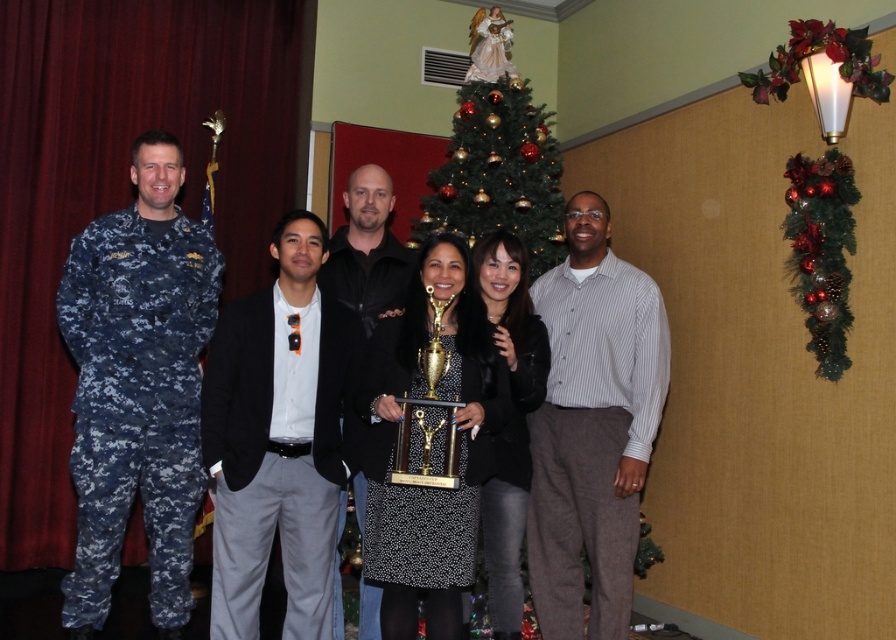
Question: Which of the following is the farthest from the observer?

Choices:
 (A) black leather jacket at center
 (B) green textured garland at upper right

Answer: (B)

Question: Is black cotton blazer at center to the left of black fabric dress at center from the viewer's perspective?

Choices:
 (A) no
 (B) yes

Answer: (B)

Question: Observing the image, what is the correct spatial positioning of green textured christmas tree at upper center in reference to green textured garland at upper right?

Choices:
 (A) left
 (B) right

Answer: (A)

Question: Is striped button-up shirt at center positioned before black fabric dress at center?

Choices:
 (A) no
 (B) yes

Answer: (A)

Question: Which point appears farthest from the camera in this image?

Choices:
 (A) [x=352, y=212]
 (B) [x=644, y=448]

Answer: (A)

Question: Which point is farther to the camera?

Choices:
 (A) digital camouflage uniform at left
 (B) black fabric jacket at center
 (C) green textured christmas tree at upper center

Answer: (C)